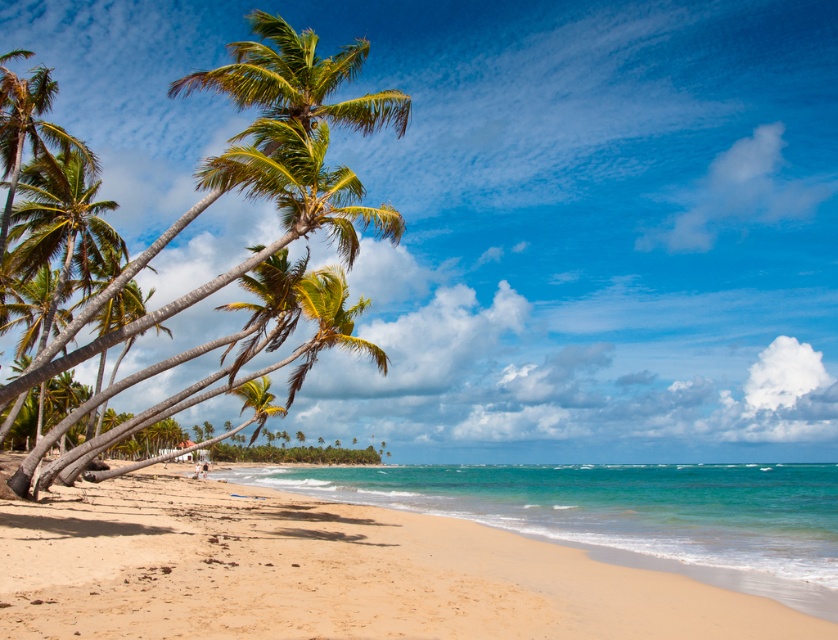
Question: Which point is closer to the camera taking this photo?

Choices:
 (A) (256, 428)
 (B) (210, 616)
 (C) (257, 35)

Answer: (B)

Question: Which object is positioned closest to the sandy beach at lower left?

Choices:
 (A) green leafy palm tree at left
 (B) green leafy palm tree at center

Answer: (B)

Question: From the image, what is the correct spatial relationship of sandy beach at lower left in relation to green leafy palm tree at center?

Choices:
 (A) below
 (B) above

Answer: (A)

Question: Observing the image, what is the correct spatial positioning of green leafy palm tree at left in reference to green leafy palm tree at center?

Choices:
 (A) left
 (B) right

Answer: (A)

Question: Is sandy beach at lower left positioned at the back of green leafy palm tree at left?

Choices:
 (A) no
 (B) yes

Answer: (A)

Question: Which object is positioned farthest from the green leafy palm tree at left?

Choices:
 (A) sandy beach at lower left
 (B) green leafy palm tree at center

Answer: (B)